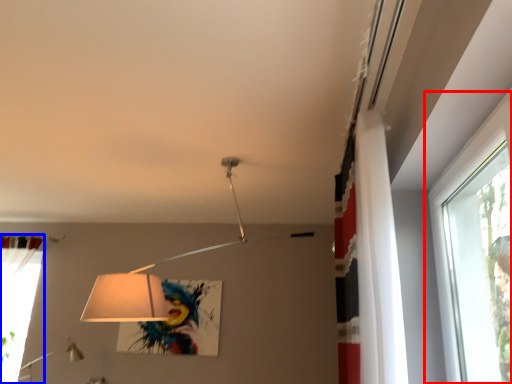
Question: Which object appears farthest to the camera in this image, window (highlighted by a red box) or curtain (highlighted by a blue box)?

Choices:
 (A) window
 (B) curtain

Answer: (B)